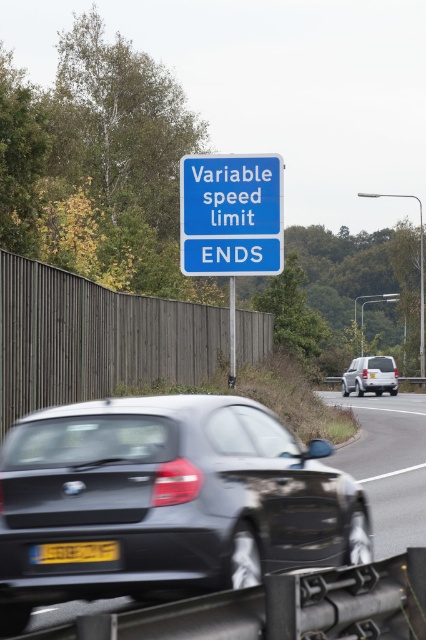
What do you see at coordinates (388, 465) in the screenshot? The width and height of the screenshot is (426, 640). I see `gray metallic car at center` at bounding box center [388, 465].

Locate an element on the screen. gray metallic car at center is located at coordinates (388, 465).

This screenshot has height=640, width=426. In order to click on gray metallic car at center in this screenshot , I will do `click(388, 465)`.

Is matte black car at center to the right of blue plastic sign at upper center from the viewer's perspective?

Correct, you'll find matte black car at center to the right of blue plastic sign at upper center.

Is point (111, 435) more distant than point (215, 236)?

No, (111, 435) is closer to viewer.

Does point (178, 564) lie behind point (189, 260)?

No.

The image size is (426, 640). I want to click on matte black car at center, so click(167, 500).

Does blue plastic sign at upper center have a lesser width compared to gray metallic car at center?

Correct, blue plastic sign at upper center's width is less than gray metallic car at center's.

Is point (279, 237) positioned in front of point (356, 472)?

That is False.

The width and height of the screenshot is (426, 640). Identify the location of blue plastic sign at upper center. (230, 214).